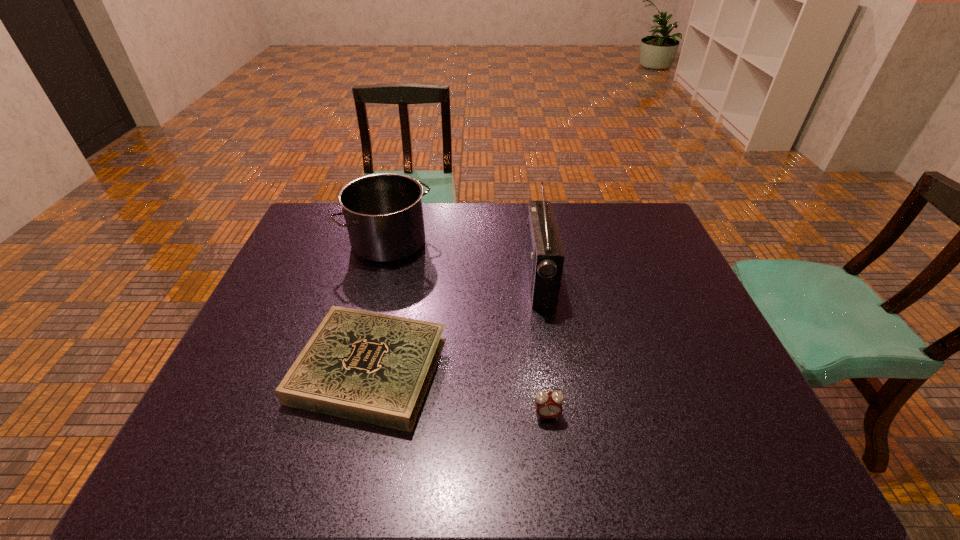
At what (x,y) coordinates should I click in order to perform the action: click on object that is at the far edge. Please return your answer as a coordinate pair (x, y). Looking at the image, I should click on (383, 212).

This screenshot has width=960, height=540. Find the location of `free point at the far edge`. free point at the far edge is located at coordinates (458, 207).

Where is `free region at the near edge`? free region at the near edge is located at coordinates (415, 445).

Locate an element on the screen. This screenshot has width=960, height=540. free space at the left edge of the desktop is located at coordinates (216, 399).

At what (x,y) coordinates should I click in order to perform the action: click on free space at the right edge of the desktop. Please return your answer as a coordinate pair (x, y). Looking at the image, I should click on (650, 307).

Find the location of a particular element. The height and width of the screenshot is (540, 960). free location at the far left corner of the desktop is located at coordinates (333, 226).

At what (x,y) coordinates should I click in order to perform the action: click on free space between the shortest object and the tallest object. Please return your answer as a coordinate pair (x, y). Looking at the image, I should click on (455, 323).

Find the location of a particular element. free space that is in between the second shortest object and the tallest object is located at coordinates (543, 346).

You are a GUI agent. You are given a task and a screenshot of the screen. Output one action in this format:
    pyautogui.click(x=<x>, y=<y>)
    Task: Click on the vacant area that lies between the alarm clock and the hardback book
    
    Given the screenshot: What is the action you would take?
    pyautogui.click(x=459, y=392)

Locate an element on the screen. vacant space in between the shortest object and the tallest object is located at coordinates (455, 323).